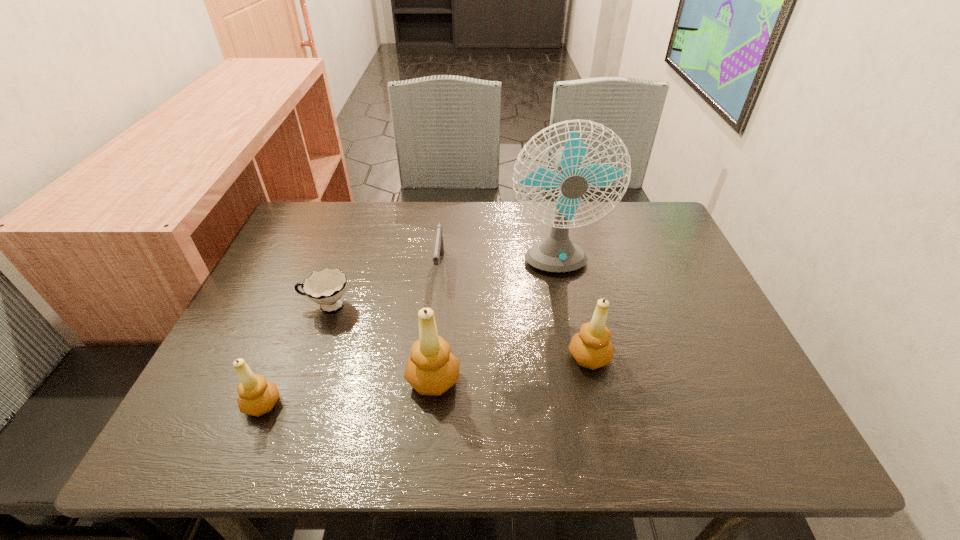
Please show where to add a candle_holder on the right while keeping spacing even. Please provide its 2D coordinates. Your answer should be formatted as a tuple, i.e. [(x, y)], where the tuple contains the x and y coordinates of a point satisfying the conditions above.

[(732, 336)]